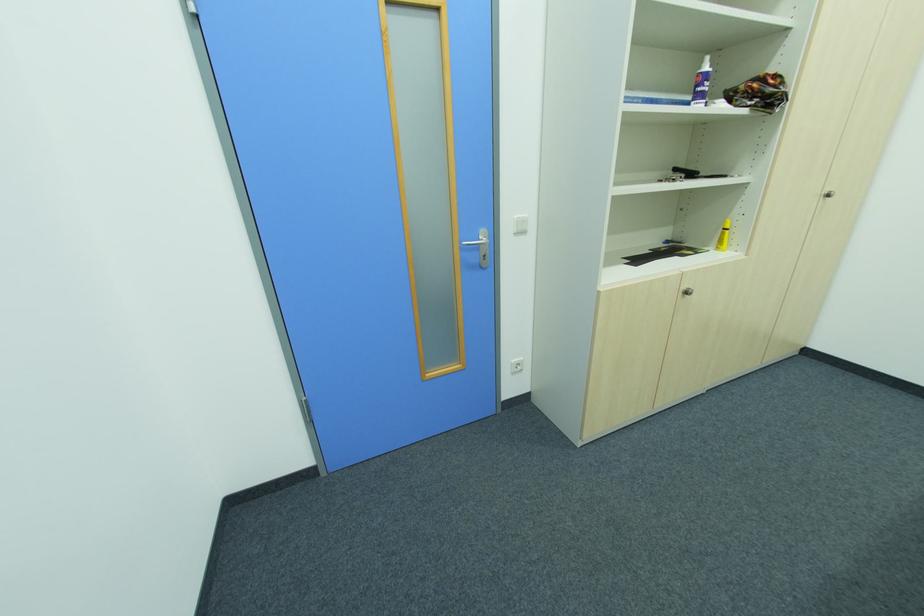
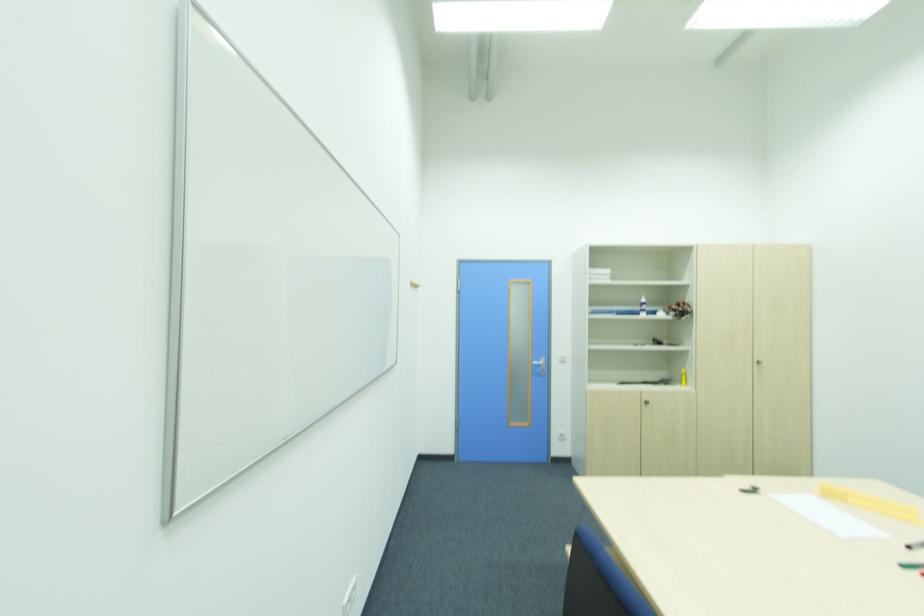
In the second image, find the point that corresponds to the point at 689,294 in the first image.

(650, 402)